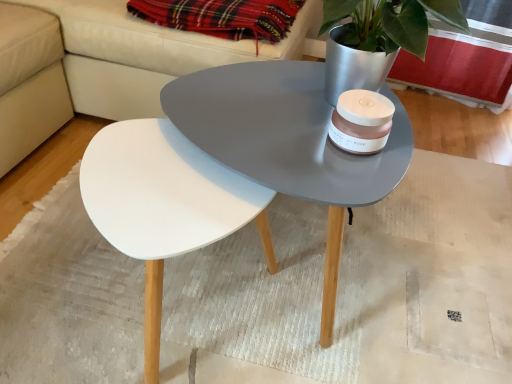
Question: Does white matte mat at center have a larger size compared to white leather couch at upper center?

Choices:
 (A) yes
 (B) no

Answer: (B)

Question: Could you tell me if white matte mat at center is turned towards white leather couch at upper center?

Choices:
 (A) no
 (B) yes

Answer: (A)

Question: Does white matte mat at center appear on the right side of white leather couch at upper center?

Choices:
 (A) no
 (B) yes

Answer: (B)

Question: Is white matte mat at center to the left of white leather couch at upper center from the viewer's perspective?

Choices:
 (A) no
 (B) yes

Answer: (A)

Question: From the image's perspective, would you say white matte mat at center is shown under white leather couch at upper center?

Choices:
 (A) yes
 (B) no

Answer: (A)

Question: Is plaid fabric at upper center spatially inside white matte mat at center, or outside of it?

Choices:
 (A) outside
 (B) inside

Answer: (A)

Question: Looking at the image, does plaid fabric at upper center seem bigger or smaller compared to white matte mat at center?

Choices:
 (A) small
 (B) big

Answer: (A)

Question: Would you say plaid fabric at upper center is to the left or to the right of white matte mat at center in the picture?

Choices:
 (A) left
 (B) right

Answer: (A)

Question: Looking at their shapes, would you say plaid fabric at upper center is wider or thinner than white matte mat at center?

Choices:
 (A) wide
 (B) thin

Answer: (B)

Question: Visually, is white leather couch at upper center positioned to the left or to the right of plaid fabric at upper center?

Choices:
 (A) left
 (B) right

Answer: (A)

Question: Is white leather couch at upper center in front of or behind plaid fabric at upper center in the image?

Choices:
 (A) behind
 (B) front

Answer: (B)

Question: Considering the positions of point (x=166, y=79) and point (x=272, y=11), is point (x=166, y=79) closer or farther from the camera than point (x=272, y=11)?

Choices:
 (A) closer
 (B) farther

Answer: (B)

Question: Considering the positions of white leather couch at upper center and plaid fabric at upper center in the image, is white leather couch at upper center wider or thinner than plaid fabric at upper center?

Choices:
 (A) thin
 (B) wide

Answer: (B)

Question: Would you say white matte mat at center is inside or outside plaid fabric at upper center?

Choices:
 (A) outside
 (B) inside

Answer: (A)

Question: Is white matte mat at center wider or thinner than plaid fabric at upper center?

Choices:
 (A) thin
 (B) wide

Answer: (B)